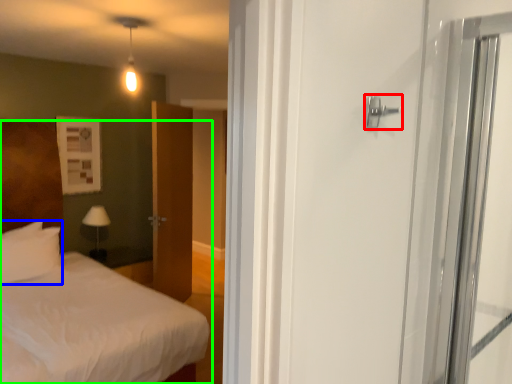
Question: Which is farther away from door handle (highlighted by a red box)? pillow (highlighted by a blue box) or bed (highlighted by a green box)?

Choices:
 (A) pillow
 (B) bed

Answer: (B)